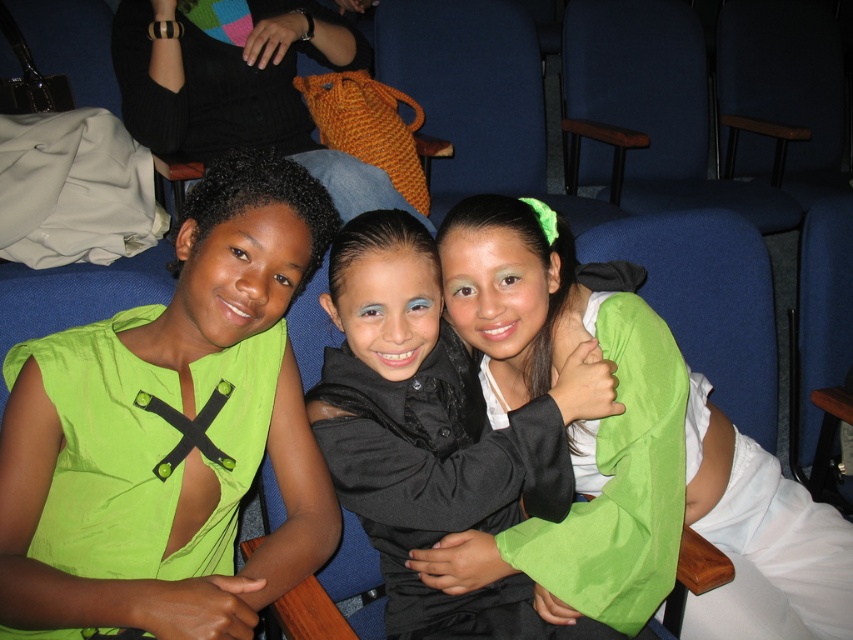
You are sitting in a theater seat and notice two people in front of you. One is wearing a lime green fabric shirt at left and the other is sitting somewhere else. Based on their positions, can you tell which person is closer to the stage?

The lime green fabric shirt at left is located at point [171,432], so the person wearing the lime green fabric shirt at left is closer to the stage since their coordinates indicate a position nearer to the front of the theater.

In the scene shown: You are attending a theater event and see the lime green fabric shirt at left and the knitted orange bag at upper center. Which object is positioned higher in the image?

The knitted orange bag at upper center is positioned higher than the lime green fabric shirt at left.

You are an event organizer trying to arrange a photo shoot in the theater. You need to ensure that the lime green fabric shirt at left and the knitted orange bag at upper center are visible in the frame. Given their sizes, which object might require more careful positioning to avoid being overshadowed?

The lime green fabric shirt at left is smaller in size compared to the knitted orange bag at upper center, so it might require more careful positioning to ensure it isn not overshadowed by the larger bag.